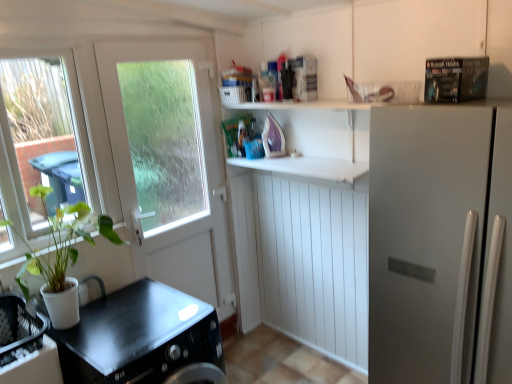
Question: From a real-world perspective, is white matte door at upper left beneath white matte counter top at center, the second counter top positioned from the left?

Choices:
 (A) no
 (B) yes

Answer: (B)

Question: Considering the relative sizes of white matte door at upper left and white matte counter top at center, the first counter top in the right-to-left sequence, in the image provided, is white matte door at upper left taller than white matte counter top at center, the first counter top in the right-to-left sequence,?

Choices:
 (A) no
 (B) yes

Answer: (B)

Question: Is white matte counter top at center, the first counter top in the right-to-left sequence, located within white matte door at upper left?

Choices:
 (A) yes
 (B) no

Answer: (B)

Question: Is white matte door at upper left in contact with white matte counter top at center, arranged as the second counter top when ordered from the bottom?

Choices:
 (A) no
 (B) yes

Answer: (A)

Question: From a real-world perspective, is white matte door at upper left located higher than white matte counter top at center, acting as the first counter top starting from the top?

Choices:
 (A) no
 (B) yes

Answer: (A)

Question: Considering the positions of white matte refrigerator at right and white matte counter top at center, acting as the first counter top starting from the top, in the image, is white matte refrigerator at right wider or thinner than white matte counter top at center, acting as the first counter top starting from the top,?

Choices:
 (A) wide
 (B) thin

Answer: (A)

Question: In terms of height, does white matte refrigerator at right look taller or shorter compared to white matte counter top at center, arranged as the second counter top when ordered from the bottom?

Choices:
 (A) short
 (B) tall

Answer: (B)

Question: From a real-world perspective, is white matte refrigerator at right positioned above or below white matte counter top at center, the second counter top positioned from the left?

Choices:
 (A) below
 (B) above

Answer: (A)

Question: Choose the correct answer: Is white matte refrigerator at right inside white matte counter top at center, arranged as the second counter top when ordered from the bottom, or outside it?

Choices:
 (A) outside
 (B) inside

Answer: (A)

Question: Does point (417, 278) appear closer or farther from the camera than point (204, 321)?

Choices:
 (A) farther
 (B) closer

Answer: (B)

Question: From a real-world perspective, is white matte refrigerator at right above or below black matte countertop at lower left, acting as the first counter top starting from the bottom?

Choices:
 (A) below
 (B) above

Answer: (B)

Question: Is white matte refrigerator at right to the left or to the right of black matte countertop at lower left, which ranks as the 2th counter top in right-to-left order, in the image?

Choices:
 (A) left
 (B) right

Answer: (B)

Question: From the image's perspective, is white matte refrigerator at right positioned above or below black matte countertop at lower left, the 2th counter top in the top-to-bottom sequence?

Choices:
 (A) above
 (B) below

Answer: (A)

Question: Looking at their shapes, would you say white matte counter top at center, acting as the first counter top starting from the top, is wider or thinner than black matte countertop at lower left, arranged as the 1th counter top when viewed from the left?

Choices:
 (A) thin
 (B) wide

Answer: (A)

Question: From the image's perspective, is white matte counter top at center, the first counter top in the right-to-left sequence, located above or below black matte countertop at lower left, the 2th counter top in the top-to-bottom sequence?

Choices:
 (A) above
 (B) below

Answer: (A)